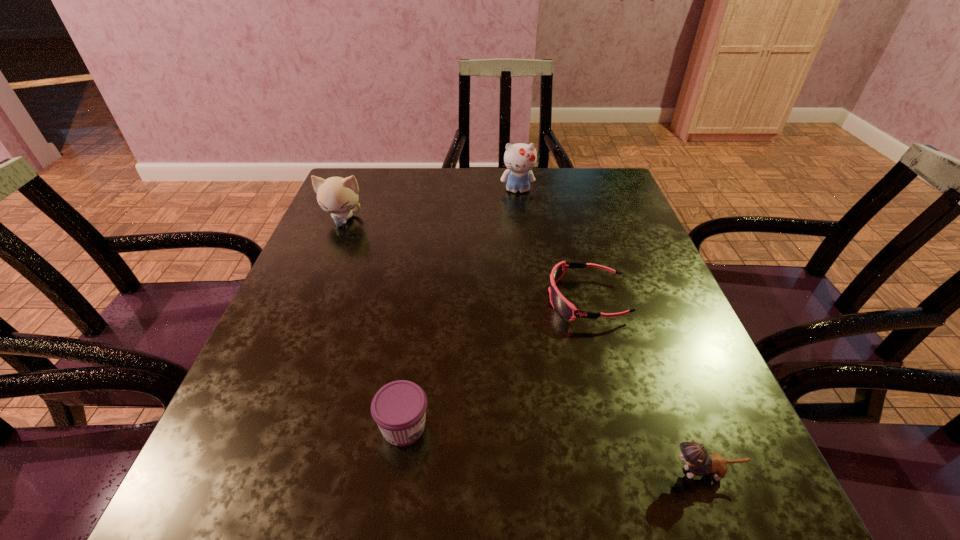
At what (x,y) coordinates should I click in order to perform the action: click on the farthest kitten. Please return your answer as a coordinate pair (x, y). This screenshot has width=960, height=540. Looking at the image, I should click on tap(520, 158).

Identify the location of the second kitten from left to right. (520, 158).

This screenshot has width=960, height=540. In order to click on the leftmost kitten in this screenshot , I will do `click(336, 195)`.

This screenshot has height=540, width=960. Find the location of `the leftmost object`. the leftmost object is located at coordinates (336, 195).

Find the location of a particular element. The height and width of the screenshot is (540, 960). the nearest object is located at coordinates (699, 463).

You are a GUI agent. You are given a task and a screenshot of the screen. Output one action in this format:
    pyautogui.click(x=<x>, y=<y>)
    Task: Click on the rightmost kitten
    
    Given the screenshot: What is the action you would take?
    pyautogui.click(x=699, y=463)

Where is `jam`? jam is located at coordinates (399, 408).

Locate an element on the screen. the second object from left to right is located at coordinates [399, 408].

You are a GUI agent. You are given a task and a screenshot of the screen. Output one action in this format:
    pyautogui.click(x=<x>, y=<y>)
    Task: Click on the shortest object
    This screenshot has height=540, width=960.
    Given the screenshot: What is the action you would take?
    pyautogui.click(x=562, y=306)

Where is `goggles`? Image resolution: width=960 pixels, height=540 pixels. goggles is located at coordinates (562, 306).